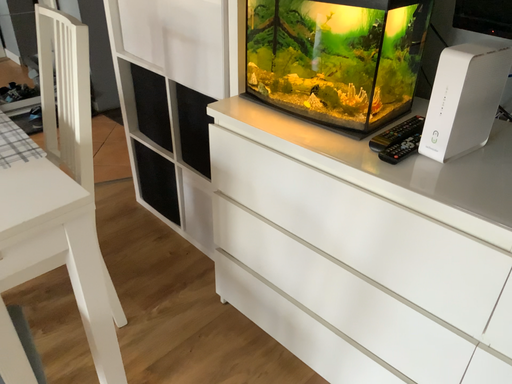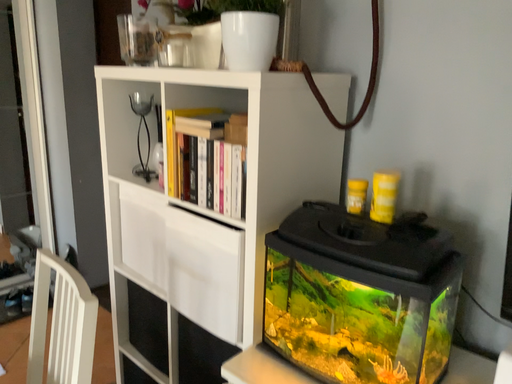
Question: Which way did the camera rotate in the video?

Choices:
 (A) rotated upward
 (B) rotated downward

Answer: (A)